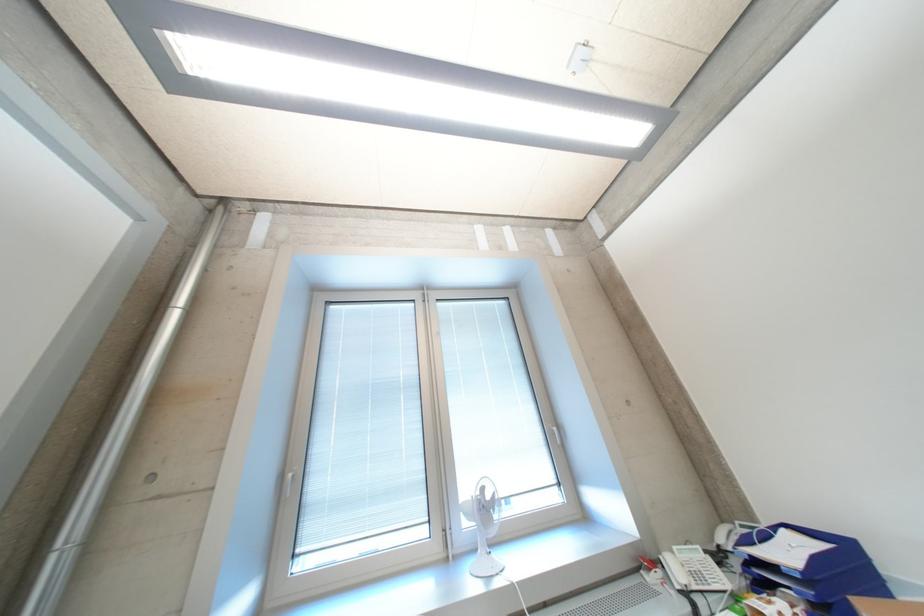
Where is `white desk fan`? white desk fan is located at coordinates (483, 525).